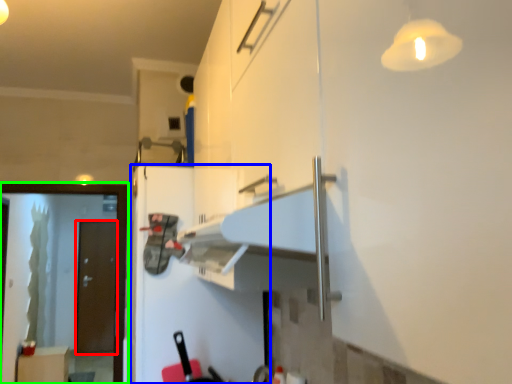
Question: Which object is positioned farthest from door (highlighted by a red box)? Select from fridge (highlighted by a blue box) and screen door (highlighted by a green box).

Choices:
 (A) fridge
 (B) screen door

Answer: (A)